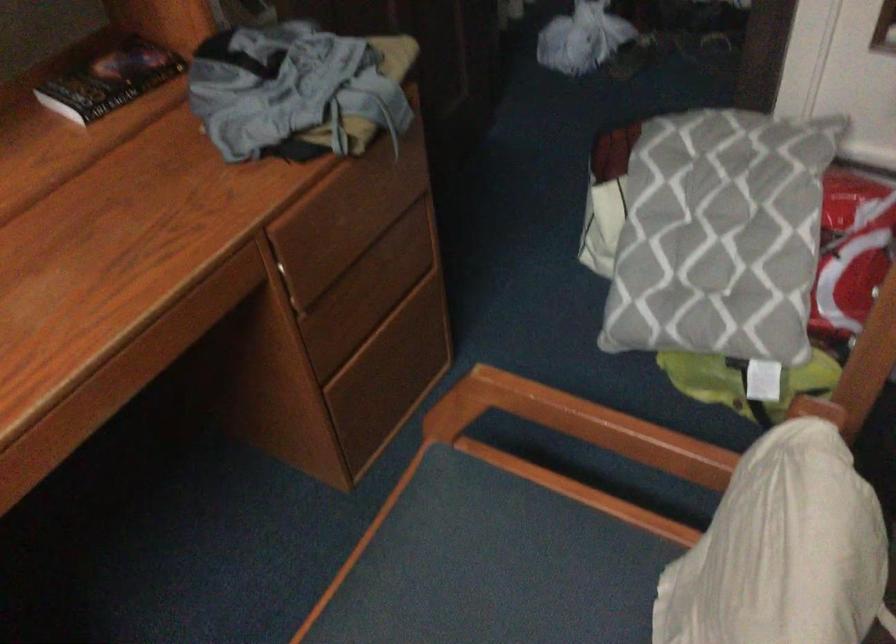
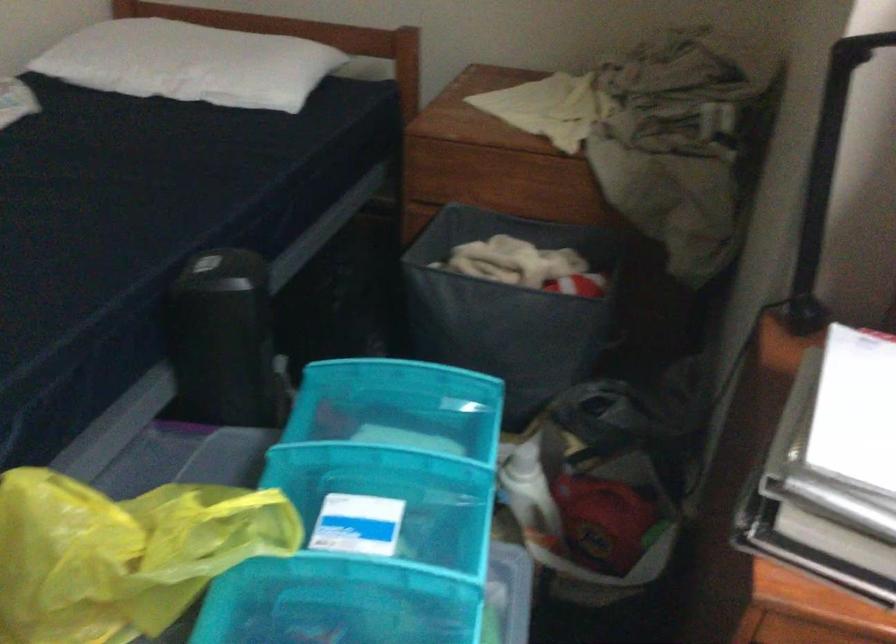
First-person continuous shooting, in which direction is the camera rotating?

The camera's rotation is toward right-down.